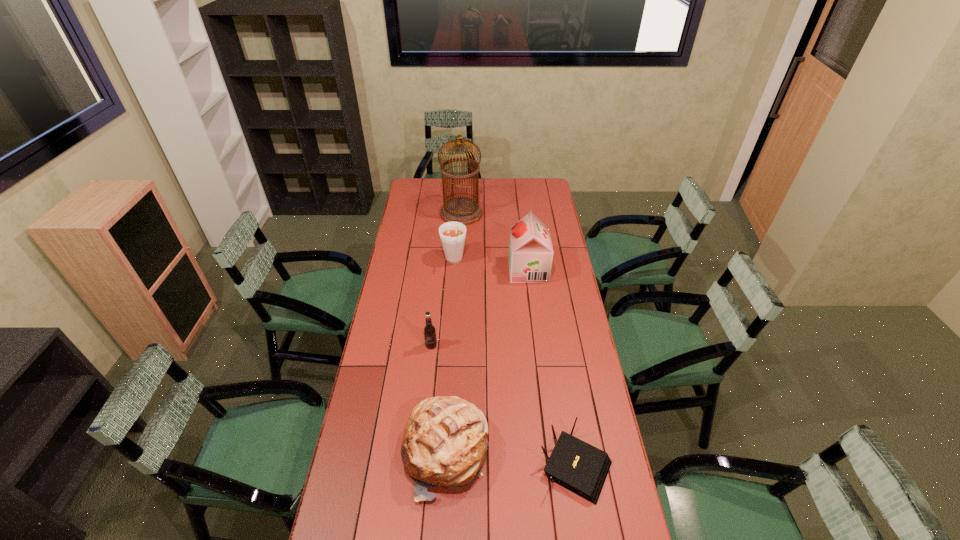
Locate an element on the screen. Image resolution: width=960 pixels, height=540 pixels. birdcage is located at coordinates (467, 211).

What are the coordinates of `the tallest object` in the screenshot? It's located at click(x=467, y=211).

Locate an element on the screen. This screenshot has width=960, height=540. the second tallest object is located at coordinates (530, 257).

Identify the location of the taller root beer. This screenshot has width=960, height=540. (452, 234).

The height and width of the screenshot is (540, 960). In order to click on the fourth shortest object in this screenshot , I will do `click(452, 234)`.

Image resolution: width=960 pixels, height=540 pixels. In order to click on the shorter root beer in this screenshot , I will do `click(429, 330)`.

You are a GUI agent. You are given a task and a screenshot of the screen. Output one action in this format:
    pyautogui.click(x=<x>, y=<y>)
    Task: Click on the fourth farthest object
    
    Given the screenshot: What is the action you would take?
    pyautogui.click(x=429, y=330)

The image size is (960, 540). Identify the location of bread. (445, 443).

This screenshot has width=960, height=540. In order to click on the shortest object in this screenshot , I will do `click(581, 468)`.

This screenshot has height=540, width=960. I want to click on vacant space situated 0.160m on the front-facing side of the farthest object, so click(x=511, y=213).